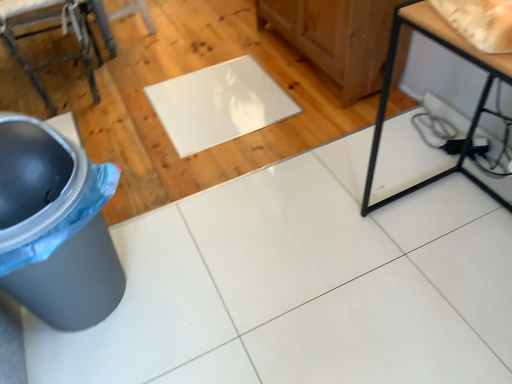
Question: Can you confirm if glossy white mat at center is positioned to the right of gray plastic trash can at lower left?

Choices:
 (A) no
 (B) yes

Answer: (B)

Question: Considering the relative sizes of glossy white mat at center and gray plastic trash can at lower left in the image provided, is glossy white mat at center shorter than gray plastic trash can at lower left?

Choices:
 (A) no
 (B) yes

Answer: (B)

Question: From the image's perspective, does glossy white mat at center appear lower than gray plastic trash can at lower left?

Choices:
 (A) yes
 (B) no

Answer: (B)

Question: Is glossy white mat at center closer to camera compared to gray plastic trash can at lower left?

Choices:
 (A) no
 (B) yes

Answer: (A)

Question: Is glossy white mat at center smaller than gray plastic trash can at lower left?

Choices:
 (A) yes
 (B) no

Answer: (A)

Question: Would you say glossy white mat at center is inside or outside metallic gray stool at upper left?

Choices:
 (A) outside
 (B) inside

Answer: (A)

Question: Is point click(x=258, y=96) positioned closer to the camera than point click(x=92, y=84)?

Choices:
 (A) farther
 (B) closer

Answer: (B)

Question: Looking at their shapes, would you say glossy white mat at center is wider or thinner than metallic gray stool at upper left?

Choices:
 (A) wide
 (B) thin

Answer: (A)

Question: Is glossy white mat at center in front of or behind metallic gray stool at upper left in the image?

Choices:
 (A) behind
 (B) front

Answer: (A)

Question: Considering their positions, is glossy white mat at center located in front of or behind black metal table at lower right?

Choices:
 (A) behind
 (B) front

Answer: (A)

Question: Considering the positions of glossy white mat at center and black metal table at lower right in the image, is glossy white mat at center taller or shorter than black metal table at lower right?

Choices:
 (A) tall
 (B) short

Answer: (B)

Question: Based on their sizes in the image, would you say glossy white mat at center is bigger or smaller than black metal table at lower right?

Choices:
 (A) small
 (B) big

Answer: (A)

Question: Considering the relative positions of glossy white mat at center and black metal table at lower right in the image provided, is glossy white mat at center to the left or to the right of black metal table at lower right?

Choices:
 (A) left
 (B) right

Answer: (A)

Question: In terms of width, does black metal table at lower right look wider or thinner when compared to glossy white mat at center?

Choices:
 (A) wide
 (B) thin

Answer: (B)

Question: Choose the correct answer: Is black metal table at lower right inside glossy white mat at center or outside it?

Choices:
 (A) inside
 (B) outside

Answer: (B)